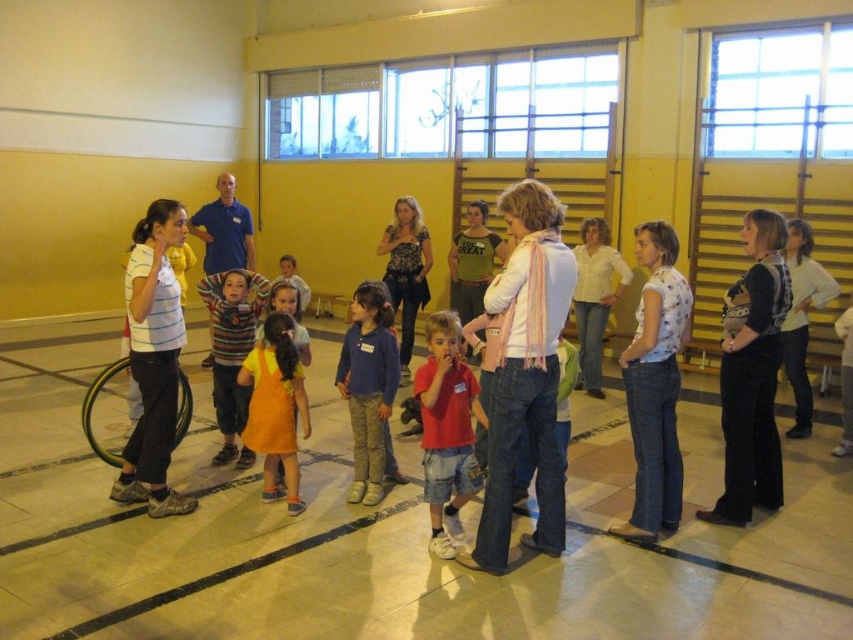
This screenshot has height=640, width=853. What do you see at coordinates (525, 372) in the screenshot?
I see `pink scarf at center` at bounding box center [525, 372].

Locate an element on the screen. pink scarf at center is located at coordinates (525, 372).

What are the coordinates of `pink scarf at center` in the screenshot? It's located at (525, 372).

Does point (730, 445) come in front of point (279, 400)?

Yes, it is in front of point (279, 400).

Can you confirm if black matte pants at right is wider than orange cotton dress at center?

Yes.

Where is `black matte pants at right`? The image size is (853, 640). black matte pants at right is located at coordinates (752, 374).

Locate an element on the screen. This screenshot has height=640, width=853. blue cotton shirt at center is located at coordinates (369, 388).

Between blue cotton shirt at center and blue shirt at center, which one has more height?

blue cotton shirt at center

Image resolution: width=853 pixels, height=640 pixels. In order to click on blue cotton shirt at center in this screenshot , I will do `click(369, 388)`.

The height and width of the screenshot is (640, 853). I want to click on blue cotton shirt at center, so click(369, 388).